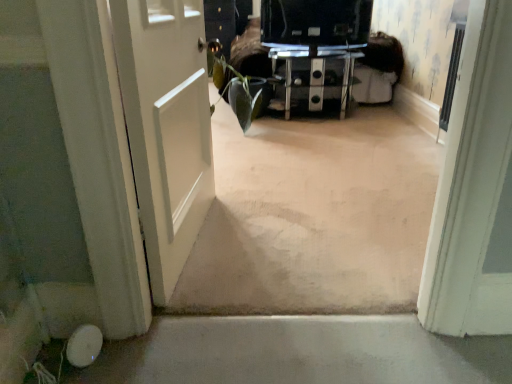
Question: Is white matte door at left situated inside black glossy tv at center or outside?

Choices:
 (A) inside
 (B) outside

Answer: (B)

Question: Considering the positions of white matte door at left and black glossy tv at center in the image, is white matte door at left taller or shorter than black glossy tv at center?

Choices:
 (A) short
 (B) tall

Answer: (B)

Question: Based on their relative distances, which object is nearer to the white matte door at left?

Choices:
 (A) black glass tv stand at center
 (B) black glossy tv at center

Answer: (B)

Question: Based on their relative distances, which object is farther from the white matte door at left?

Choices:
 (A) black glossy tv at center
 (B) black glass tv stand at center

Answer: (B)